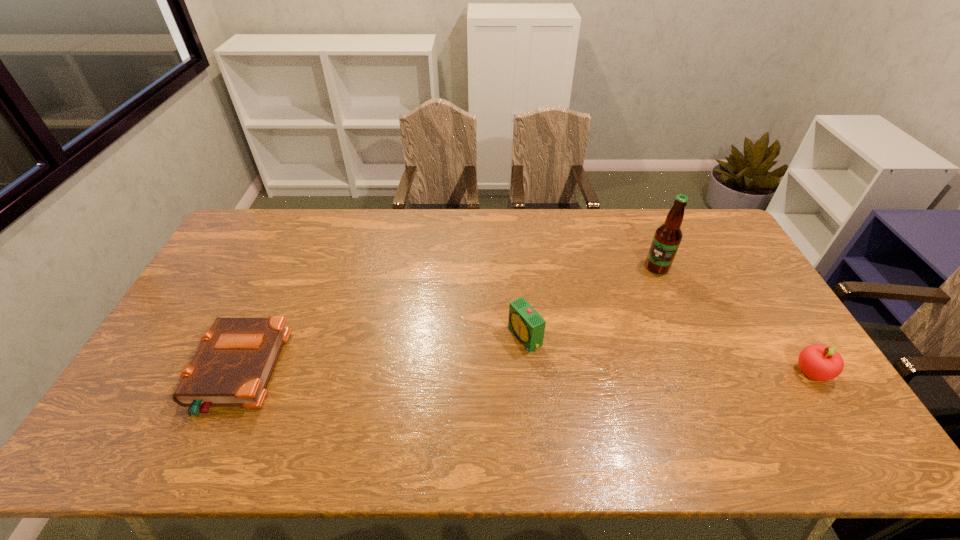
Identify the location of free space located 0.180m on the label of the tallest object. pyautogui.click(x=611, y=294).

I want to click on free space located 0.140m on the label of the tallest object, so click(619, 288).

Locate an element on the screen. The image size is (960, 540). free space located on the front-facing side of the second object from left to right is located at coordinates (402, 402).

At what (x,y) coordinates should I click in order to perform the action: click on free space located on the front-facing side of the second object from left to right. Please return your answer as a coordinate pair (x, y). The height and width of the screenshot is (540, 960). Looking at the image, I should click on (426, 389).

Where is `vacant space situated 0.180m on the front-facing side of the second object from left to right`? The image size is (960, 540). vacant space situated 0.180m on the front-facing side of the second object from left to right is located at coordinates (456, 374).

Locate an element on the screen. The image size is (960, 540). Bible situated at the near edge is located at coordinates (233, 366).

This screenshot has height=540, width=960. I want to click on apple that is at the near edge, so click(x=819, y=362).

Locate an element on the screen. The height and width of the screenshot is (540, 960). object that is at the left edge is located at coordinates (233, 366).

Image resolution: width=960 pixels, height=540 pixels. I want to click on object that is positioned at the right edge, so click(x=819, y=362).

This screenshot has height=540, width=960. I want to click on object that is at the near left corner, so 233,366.